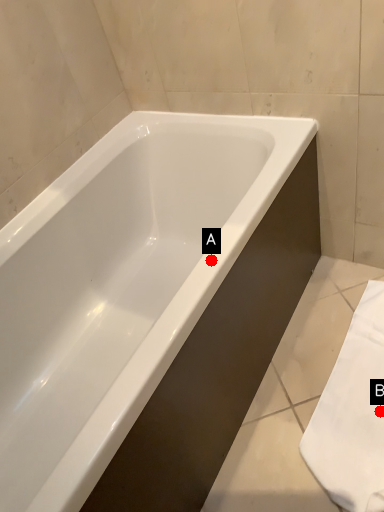
Question: Two points are circled on the image, labeled by A and B beside each circle. Which point is closer to the camera taking this photo?

Choices:
 (A) A is closer
 (B) B is closer

Answer: (A)